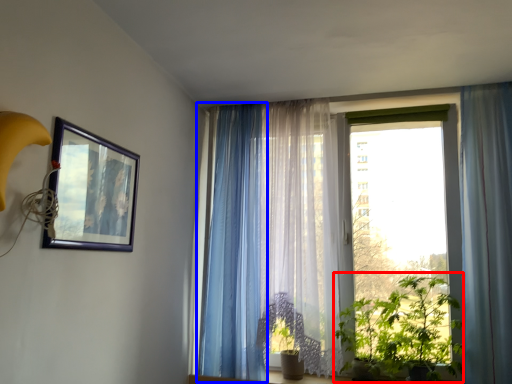
Question: Which of the following is the closest to the observer, vegetation (highlighted by a red box) or curtain (highlighted by a blue box)?

Choices:
 (A) vegetation
 (B) curtain

Answer: (A)